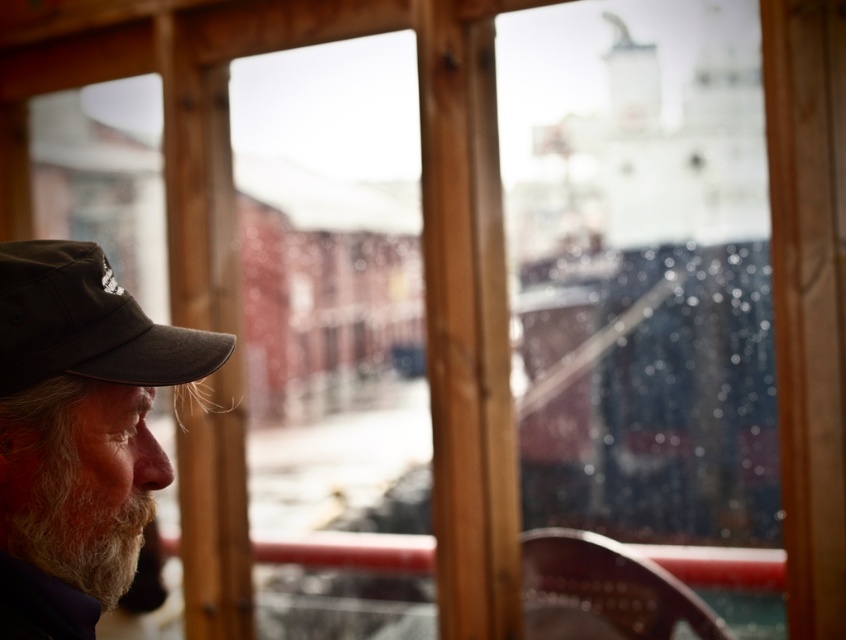
Question: Which is farther from the gray fabric cap at left?

Choices:
 (A) white fuzzy beard at lower left
 (B) dark brown fabric baseball cap at lower left

Answer: (B)

Question: Considering the relative positions of dark brown fabric baseball cap at lower left and white fuzzy beard at lower left in the image provided, where is dark brown fabric baseball cap at lower left located with respect to white fuzzy beard at lower left?

Choices:
 (A) right
 (B) left

Answer: (A)

Question: Among these points, which one is nearest to the camera?

Choices:
 (A) pyautogui.click(x=40, y=253)
 (B) pyautogui.click(x=88, y=497)
 (C) pyautogui.click(x=88, y=348)

Answer: (C)

Question: Is dark brown fabric baseball cap at lower left bigger than white fuzzy beard at lower left?

Choices:
 (A) no
 (B) yes

Answer: (B)

Question: Does gray fabric cap at left have a lesser width compared to white fuzzy beard at lower left?

Choices:
 (A) no
 (B) yes

Answer: (A)

Question: Which point is closer to the camera taking this photo?

Choices:
 (A) 141,324
 (B) 34,509
 (C) 70,515

Answer: (B)